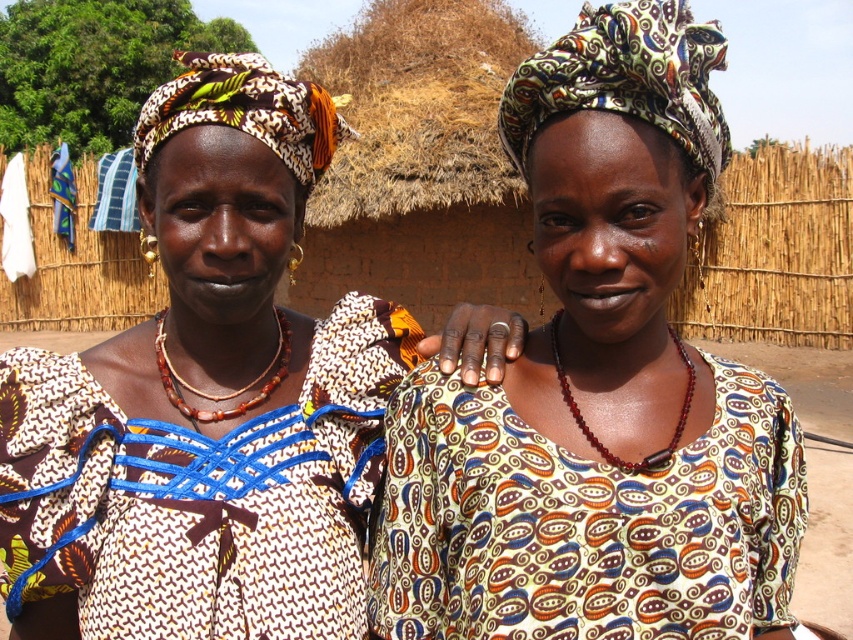
In the scene shown: You are a photographer trying to capture the two women in the scene. You want to ensure that both points, point (625, 109) and point (770, 612), are clearly visible in your photo. Since you can only focus on one point at a time, which point should you focus on to make sure the closer one is sharp?

Point (625, 109) is closer to the viewer than point (770, 612), so you should focus on point (625, 109) to ensure the closer one is sharp.